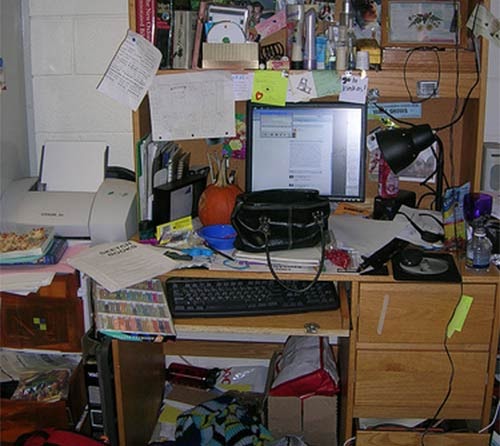
I want to click on shelves, so (424, 313), (411, 375), (412, 429).